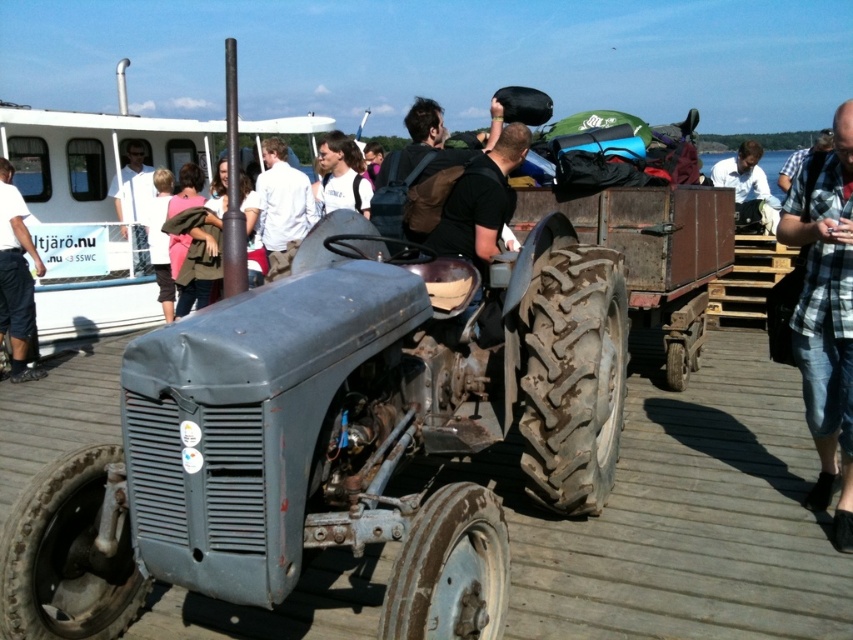
You are observing a group of people at a dock preparing for an event. You notice two individuals wearing a plaid cotton shirt at center and a light blue shirt at upper center. Which person is taller?

The plaid cotton shirt at center is taller than the light blue shirt at upper center, so the person wearing the plaid cotton shirt at center is taller.

You are standing at the position of the vintage tractor on the dock. You see two people wearing light blue shirts in the scene. The first is wearing a light blue shirt at center, and the second is wearing a light blue shirt at upper center. If you want to call both of them over, which direction should you face to address each person individually?

To address the person wearing the light blue shirt at center, you should face towards the center of the dock. To address the person wearing the light blue shirt at upper center, you should face towards the upper center direction, as they are 8.61 meters apart from each other.